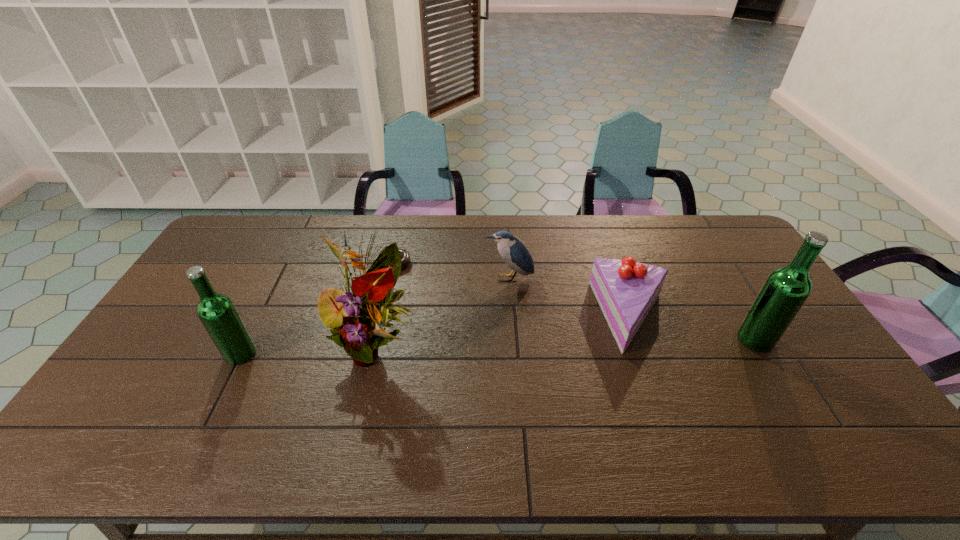
You are a GUI agent. You are given a task and a screenshot of the screen. Output one action in this format:
    pyautogui.click(x=<x>, y=<y>)
    Task: Click on the vacant spot for a new beer_bottle to ensure equal spacing
    The image size is (960, 540).
    Given the screenshot: What is the action you would take?
    pyautogui.click(x=502, y=347)